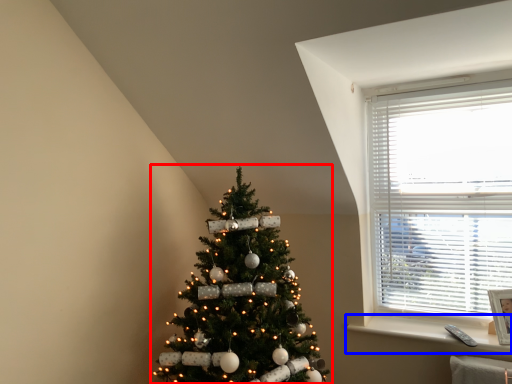
Question: Which object appears closest to the camera in this image, christmas tree (highlighted by a red box) or window sill (highlighted by a blue box)?

Choices:
 (A) christmas tree
 (B) window sill

Answer: (A)